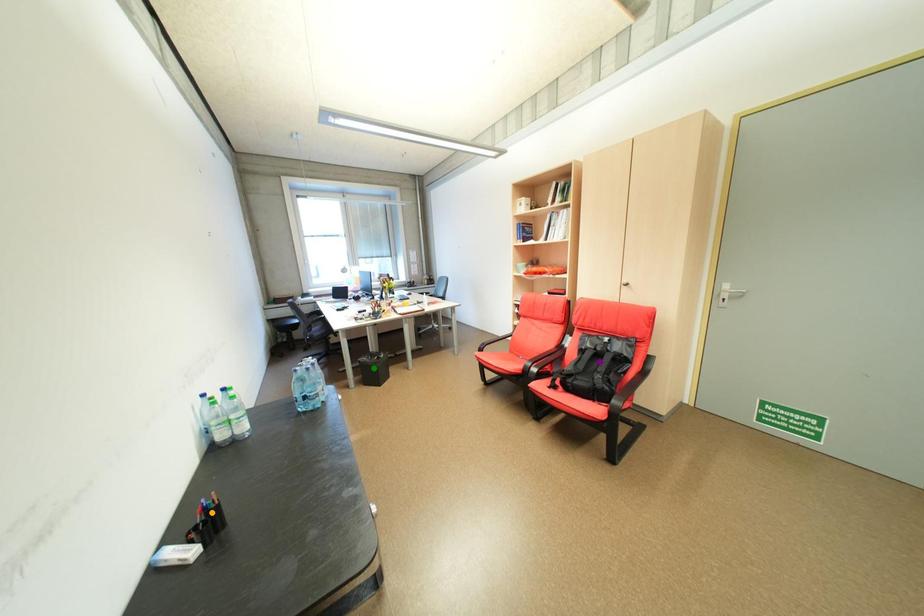
Order these from nearest to farthest:
green point
orange point
purple point

orange point < purple point < green point